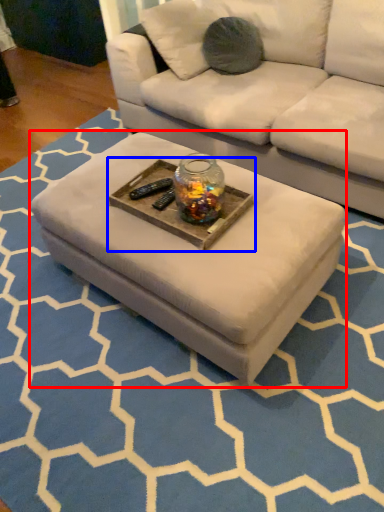
Question: Which object appears closest to the camera in this image, coffee table (highlighted by a red box) or round table (highlighted by a blue box)?

Choices:
 (A) coffee table
 (B) round table

Answer: (A)